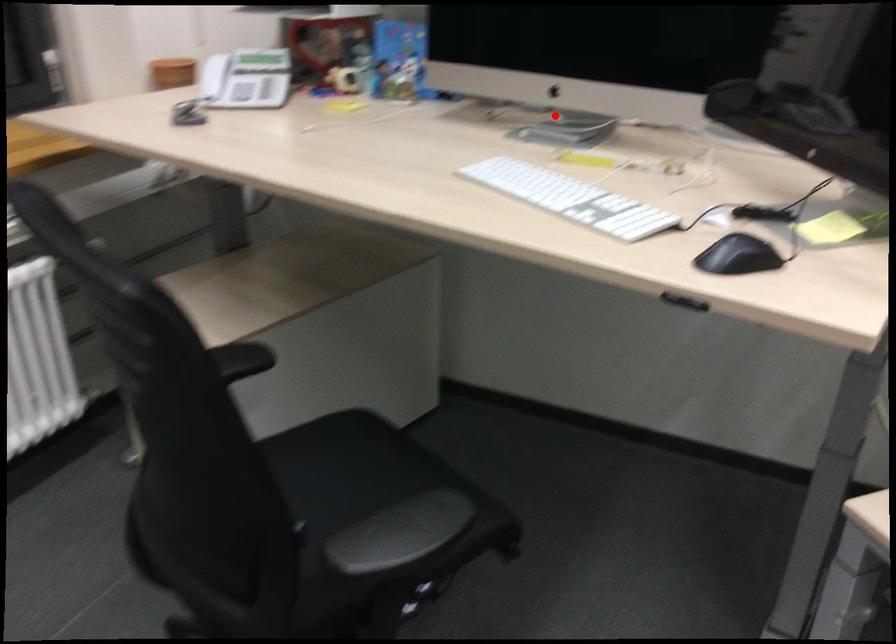
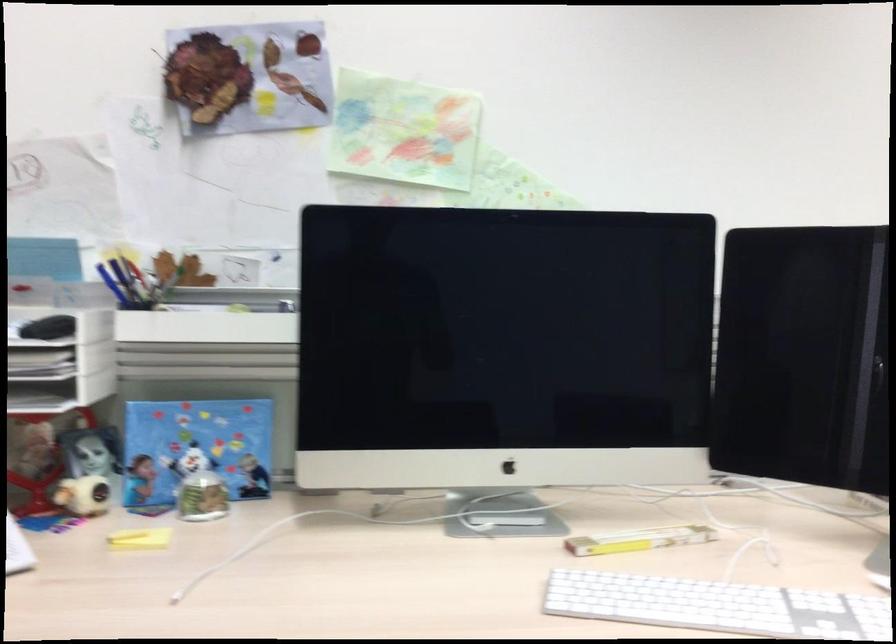
Question: I am providing you with two images of the same scene from different viewpoints. Given a red point in image1, look at the same physical point in image2. Is it:

Choices:
 (A) Closer to the viewpoint
 (B) Farther from the viewpoint

Answer: (A)